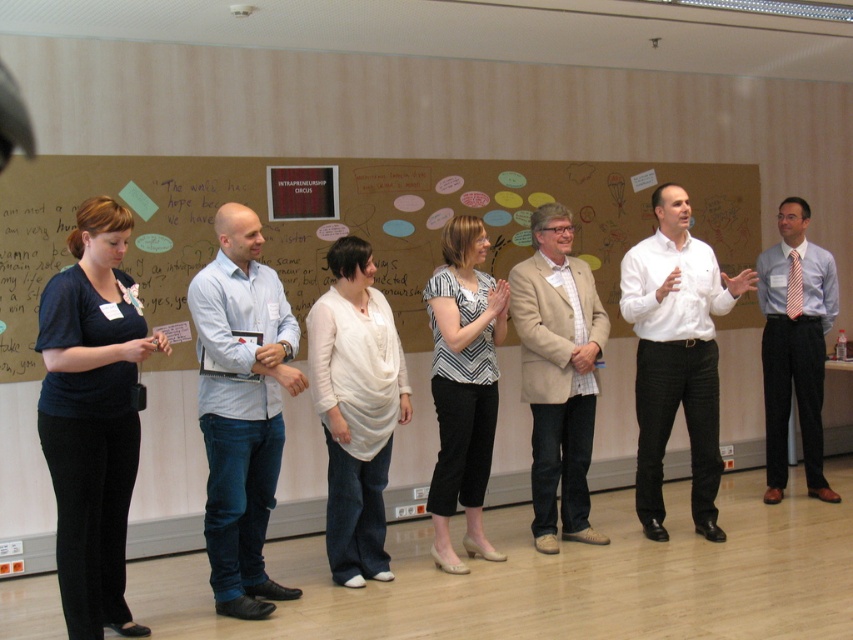
Which is in front, point (358, 394) or point (798, 224)?

Positioned in front is point (358, 394).

Is point (334, 378) farther from viewer compared to point (798, 388)?

No, it is not.

Is point (380, 372) closer to viewer compared to point (816, 458)?

Yes, it is in front of point (816, 458).

Locate an element on the screen. This screenshot has width=853, height=640. white soft fabric blouse at center is located at coordinates (355, 408).

Based on the photo, is light blue denim jeans at center smaller than white shirt at center?

Correct, light blue denim jeans at center occupies less space than white shirt at center.

Who is positioned more to the left, light blue denim jeans at center or white shirt at center?

From the viewer's perspective, light blue denim jeans at center appears more on the left side.

Does point (231, 540) come in front of point (672, 358)?

Yes, it is.

Image resolution: width=853 pixels, height=640 pixels. What are the coordinates of `light blue denim jeans at center` in the screenshot? It's located at (241, 406).

Is dark blue jersey at left wider than beige fabric blazer at center?

Incorrect, dark blue jersey at left's width does not surpass beige fabric blazer at center's.

Is point (48, 435) farther from camera compared to point (552, 209)?

No, it is not.

Locate an element on the screen. dark blue jersey at left is located at coordinates (91, 416).